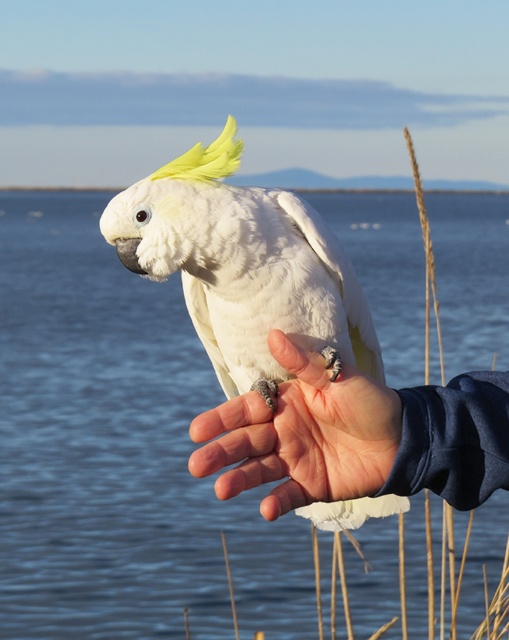
Question: Which of the following is the closest to the observer?

Choices:
 (A) smooth skin palm at center
 (B) transparent blue water at center
 (C) white feathered parrot at center

Answer: (A)

Question: Does white feathered parrot at center have a lesser width compared to smooth skin palm at center?

Choices:
 (A) no
 (B) yes

Answer: (A)

Question: Which point is closer to the camera taking this photo?

Choices:
 (A) (96, 564)
 (B) (379, 412)

Answer: (B)

Question: Which object is farther from the camera taking this photo?

Choices:
 (A) transparent blue water at center
 (B) white feathered parrot at center
 (C) smooth skin palm at center

Answer: (A)

Question: Does transparent blue water at center come in front of white feathered parrot at center?

Choices:
 (A) no
 (B) yes

Answer: (A)

Question: Does transparent blue water at center have a greater width compared to white feathered parrot at center?

Choices:
 (A) yes
 (B) no

Answer: (A)